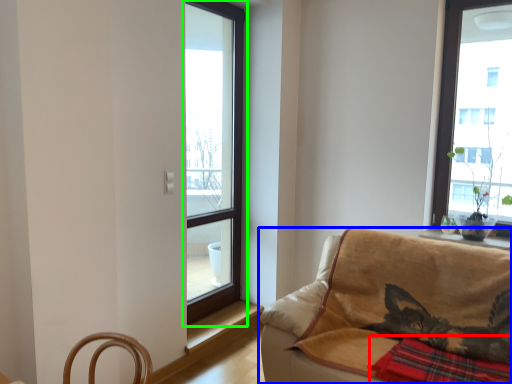
Question: Which object is positioned closest to plaid (highlighted by a red box)? Select from studio couch (highlighted by a blue box) and window (highlighted by a green box).

Choices:
 (A) studio couch
 (B) window

Answer: (A)